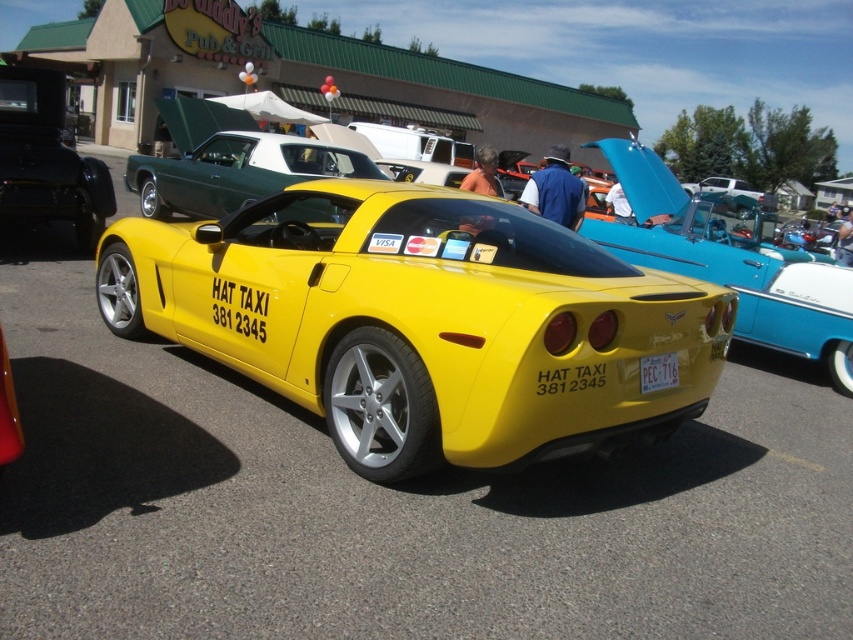
Can you confirm if yellow matte sports car at center is positioned above green metallic car at upper left?

No.

Does yellow matte sports car at center have a smaller size compared to green metallic car at upper left?

No.

Is point (436, 312) in front of point (212, 189)?

Yes, it is in front of point (212, 189).

I want to click on yellow matte sports car at center, so click(421, 321).

Is yellow matte sports car at center wider than white plastic license plate at rear?

Yes.

Does yellow matte sports car at center have a lesser height compared to white plastic license plate at rear?

Incorrect, yellow matte sports car at center's height does not fall short of white plastic license plate at rear's.

Which is behind, point (415, 362) or point (643, 380)?

The point (643, 380) is behind.

Locate an element on the screen. yellow matte sports car at center is located at coordinates (421, 321).

Which of these two, green metallic car at upper left or white plastic license plate at rear, stands taller?

Standing taller between the two is green metallic car at upper left.

Where is `green metallic car at upper left`? This screenshot has width=853, height=640. green metallic car at upper left is located at coordinates (236, 172).